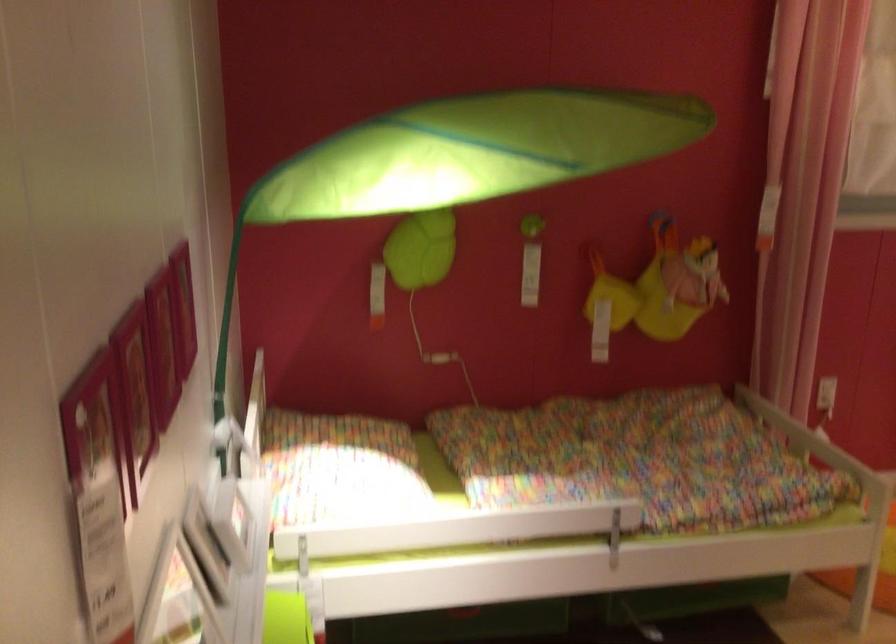
Find the location of a particular element. The width and height of the screenshot is (896, 644). patterned pillow is located at coordinates (339, 468).